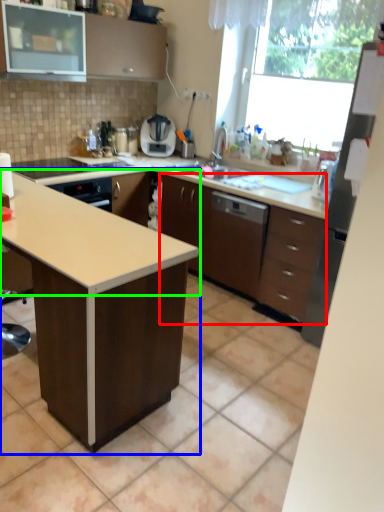
Question: Estimate the real-world distances between objects in this image. Which object is farther from cabinetry (highlighted by a red box), table (highlighted by a blue box) or countertop (highlighted by a green box)?

Choices:
 (A) table
 (B) countertop

Answer: (A)